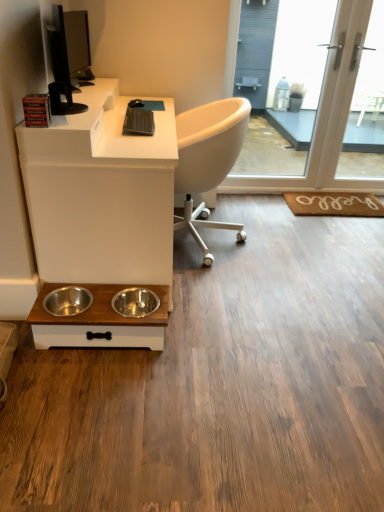
The width and height of the screenshot is (384, 512). What are the coordinates of `unoccupied region to the right of stainless steel bowls at lower center` in the screenshot? It's located at (205, 339).